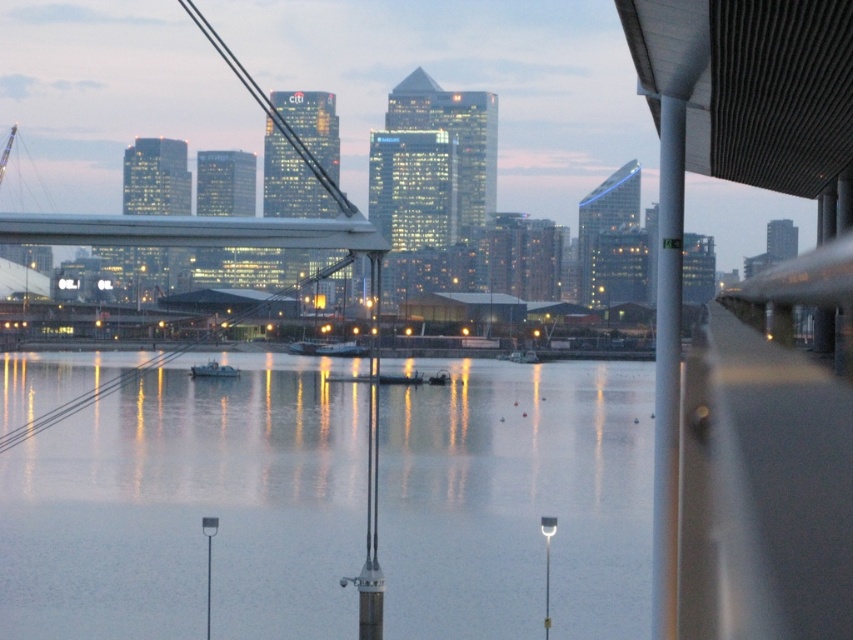
You are a photographer trying to capture the reflection of the city lights on the water. You notice the smooth water at center and the metallic gray boat at center. Which object would provide a better surface for reflecting the city lights, and why?

The smooth water at center would provide a better surface for reflecting the city lights because it is larger in size than the metallic gray boat at center, allowing for a more expansive and undisturbed reflection.

You are a photographer standing at the waterfront. You want to capture a shot of the smooth water at center and the metallic gray boat at center. Which object is wider in the scene?

The smooth water at center is wider than the metallic gray boat at center according to the description.

You are standing on the modern bridge in the midground and want to locate the smooth water at center. According to the coordinates provided, where should you look relative to your position?

The smooth water at center is located at coordinates point (x=189, y=509), which means it is positioned to the lower right of your current position on the bridge.